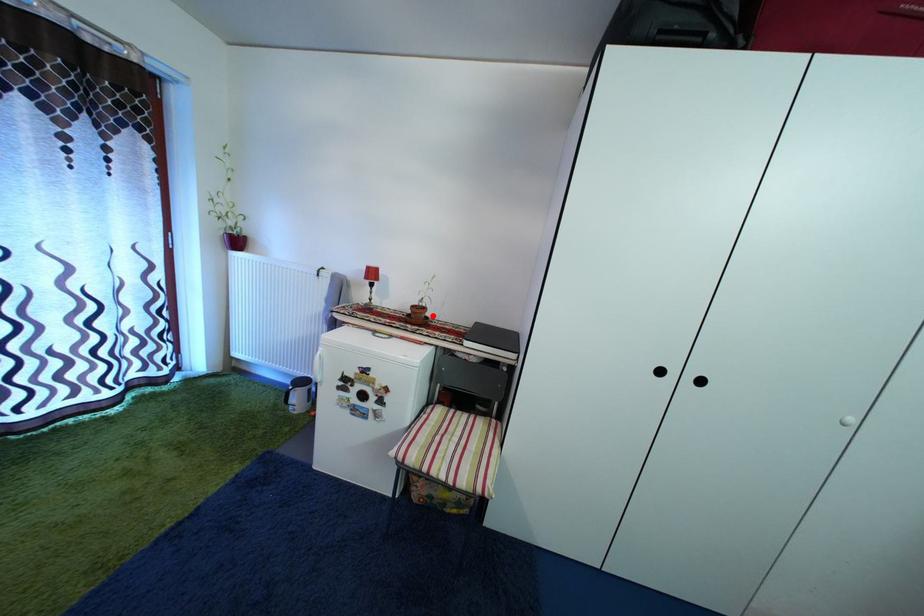
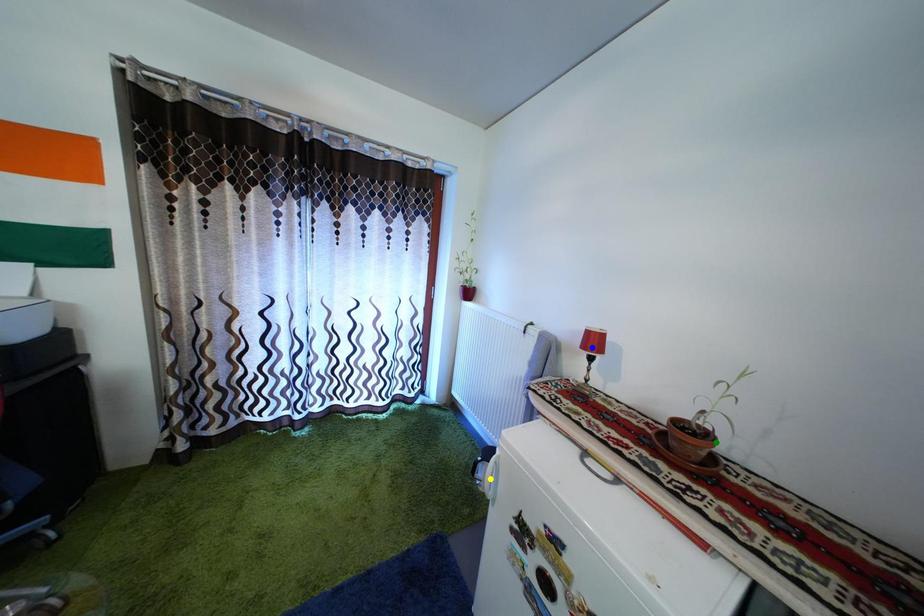
Question: I am providing you with two images of the same scene from different viewpoints. A red point is marked on the first image. You are given multiple points on the second image. In image 2, which mark is for the same physical point as the one in image 1?

Choices:
 (A) blue point
 (B) green point
 (C) yellow point

Answer: (B)